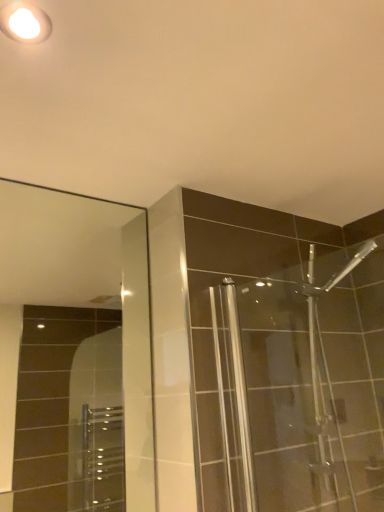
Question: Is clear glass mirror at upper left with white glossy light fixture at upper left?

Choices:
 (A) yes
 (B) no

Answer: (B)

Question: Does clear glass mirror at upper left have a greater width compared to white glossy light fixture at upper left?

Choices:
 (A) no
 (B) yes

Answer: (A)

Question: Is clear glass mirror at upper left positioned in front of white glossy light fixture at upper left?

Choices:
 (A) no
 (B) yes

Answer: (A)

Question: Is white glossy light fixture at upper left inside clear glass mirror at upper left?

Choices:
 (A) no
 (B) yes

Answer: (A)

Question: Is clear glass mirror at upper left further to the viewer compared to white glossy light fixture at upper left?

Choices:
 (A) no
 (B) yes

Answer: (B)

Question: Considering the relative positions of clear glass mirror at upper left and white glossy light fixture at upper left in the image provided, is clear glass mirror at upper left to the left of white glossy light fixture at upper left from the viewer's perspective?

Choices:
 (A) yes
 (B) no

Answer: (A)

Question: Is white glossy light fixture at upper left bigger than clear glass mirror at upper left?

Choices:
 (A) no
 (B) yes

Answer: (A)

Question: From a real-world perspective, is white glossy light fixture at upper left under clear glass mirror at upper left?

Choices:
 (A) yes
 (B) no

Answer: (B)

Question: Is white glossy light fixture at upper left not close to clear glass mirror at upper left?

Choices:
 (A) no
 (B) yes

Answer: (B)

Question: Is clear glass mirror at upper left completely or partially inside white glossy light fixture at upper left?

Choices:
 (A) no
 (B) yes

Answer: (A)

Question: Is the position of white glossy light fixture at upper left more distant than that of clear glass mirror at upper left?

Choices:
 (A) no
 (B) yes

Answer: (A)

Question: From the image's perspective, is white glossy light fixture at upper left on top of clear glass mirror at upper left?

Choices:
 (A) no
 (B) yes

Answer: (B)

Question: From a real-world perspective, is clear glass mirror at upper left physically located above or below white glossy light fixture at upper left?

Choices:
 (A) above
 (B) below

Answer: (B)